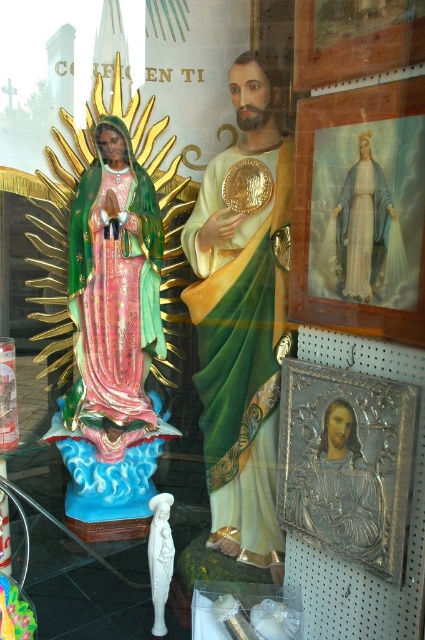
Question: Does polished gold statue at center appear on the left side of shiny pink statue at left?

Choices:
 (A) yes
 (B) no

Answer: (B)

Question: Is polished gold statue at center below shiny pink statue at left?

Choices:
 (A) yes
 (B) no

Answer: (A)

Question: Can you confirm if polished gold statue at center is wider than shiny pink statue at left?

Choices:
 (A) no
 (B) yes

Answer: (A)